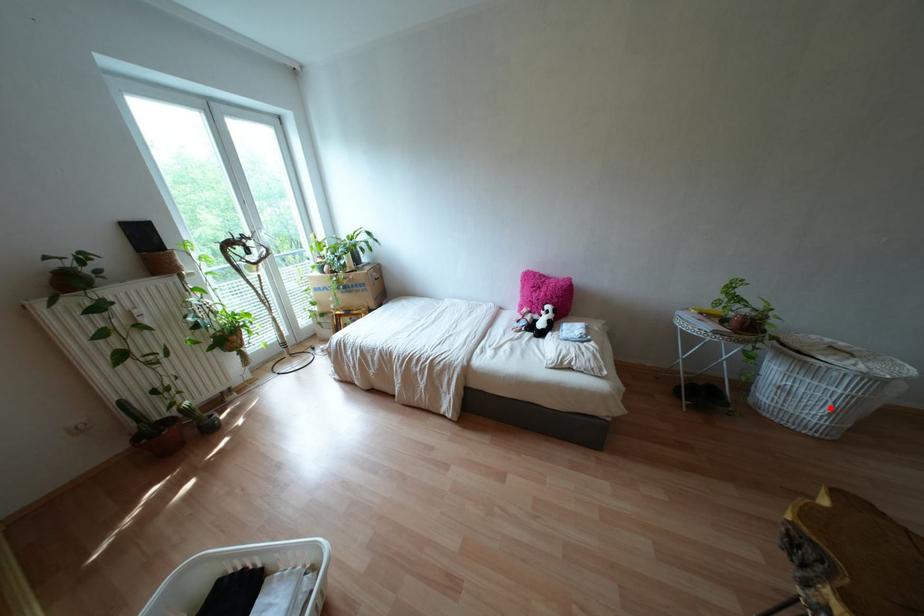
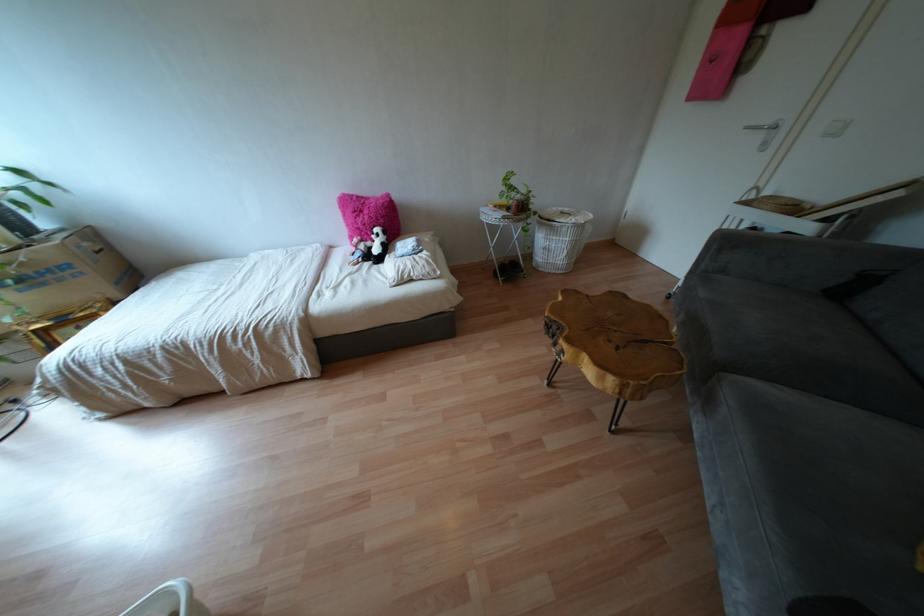
The point at the highlighted location is marked in the first image. Where is the corresponding point in the second image?

(565, 252)